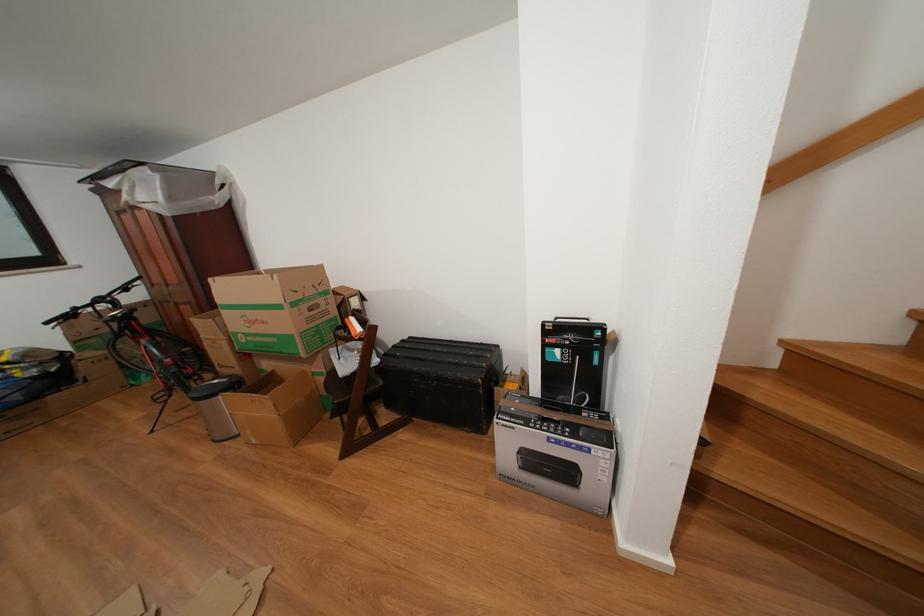
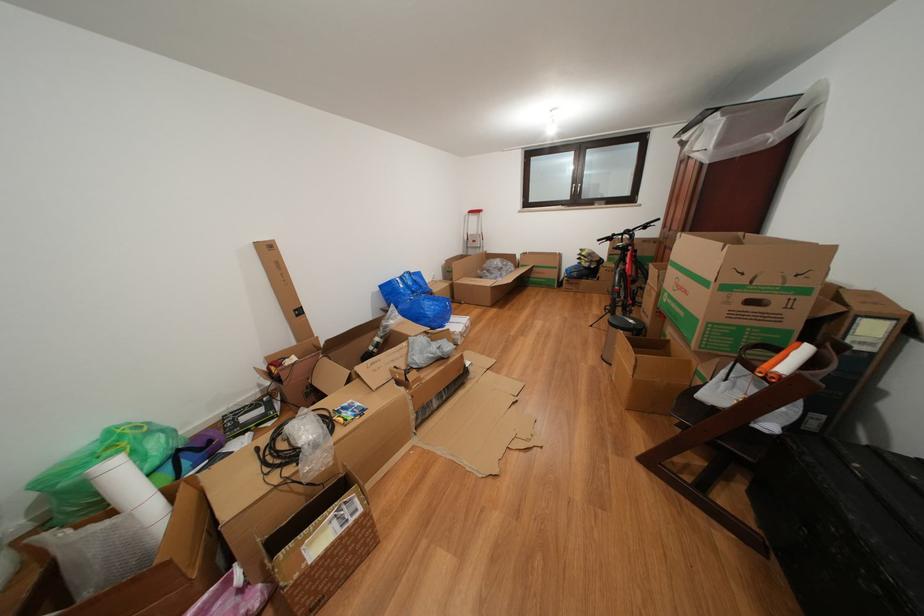
The point at (257, 448) is marked in the first image. Where is the corresponding point in the second image?

(619, 382)